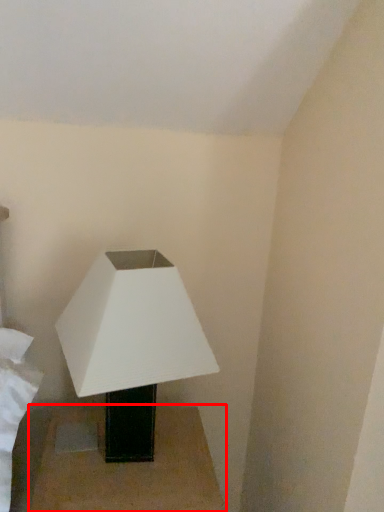
Question: From the image's perspective, what is the correct spatial positioning of table (annotated by the red box) in reference to lamp?

Choices:
 (A) above
 (B) below

Answer: (B)